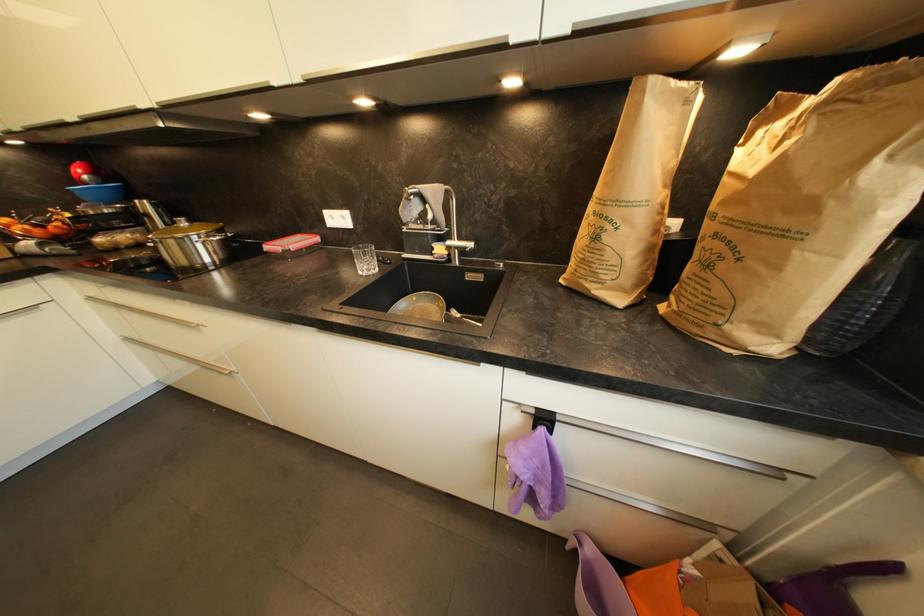
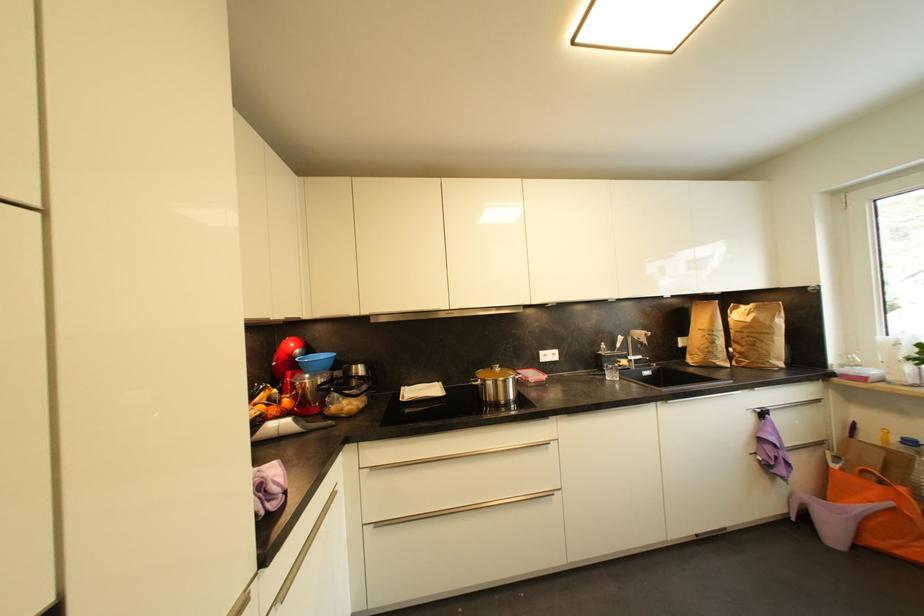
Locate, in the second image, the point that corresponds to point (711, 529) in the first image.

(825, 446)